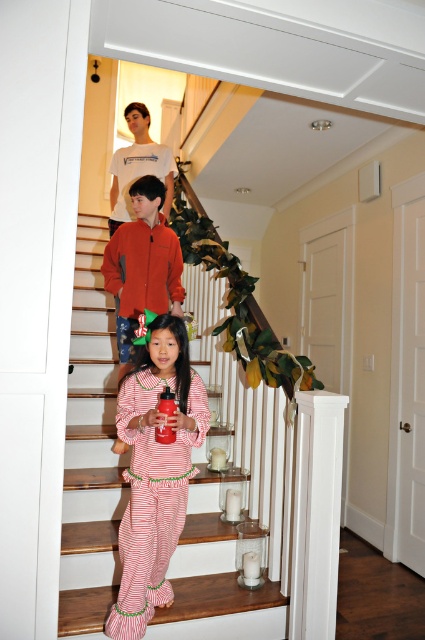
Question: Is white t-shirt at upper center in front of glossy plastic soda at center?

Choices:
 (A) yes
 (B) no

Answer: (B)

Question: Is red striped pajamas at center thinner than glossy plastic soda at center?

Choices:
 (A) no
 (B) yes

Answer: (A)

Question: Which point appears closest to the camera in this image?

Choices:
 (A) (99, 387)
 (B) (155, 172)

Answer: (A)

Question: Which point is closer to the camera?

Choices:
 (A) red striped pajamas at center
 (B) orange fleece jacket at center
 (C) white t-shirt at upper center

Answer: (A)

Question: Can you confirm if red striped pajamas at center is thinner than orange fleece jacket at center?

Choices:
 (A) no
 (B) yes

Answer: (B)

Question: Which of the following is the closest to the observer?

Choices:
 (A) (132, 349)
 (B) (149, 173)

Answer: (A)